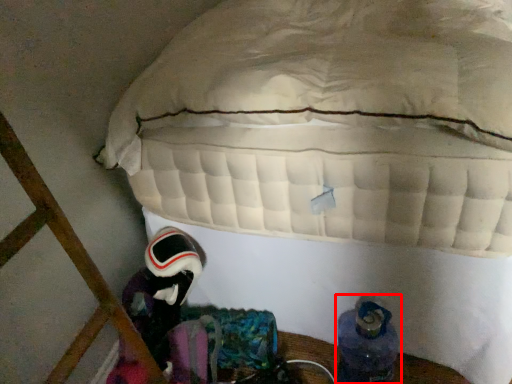
Question: From the image's perspective, what is the correct spatial positioning of footwear (annotated by the red box) in reference to astronaut?

Choices:
 (A) above
 (B) below

Answer: (B)